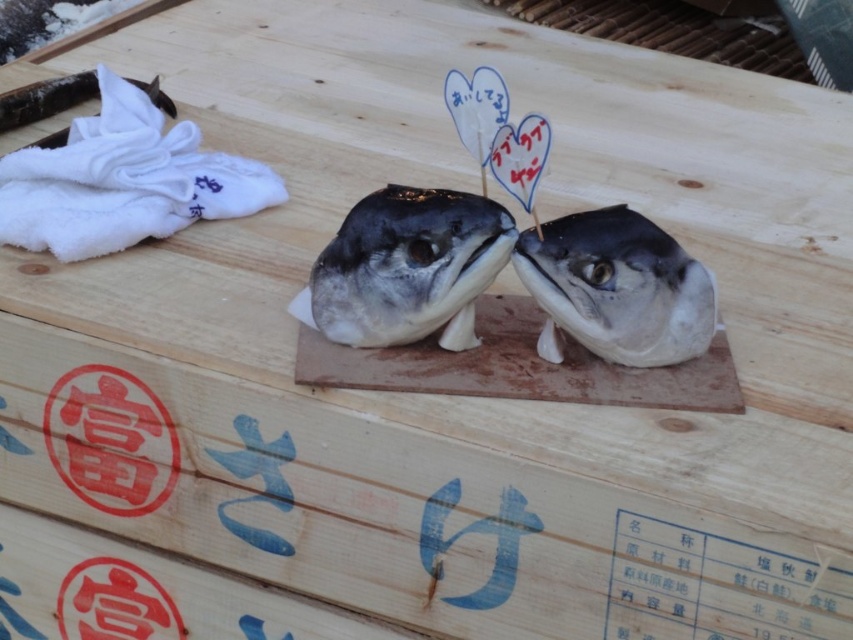
Question: Which object is the closest to the white towel at upper left?

Choices:
 (A) shiny black fish head at center
 (B) shiny silver fish head at center

Answer: (A)

Question: Is white towel at upper left wider than shiny black fish head at center?

Choices:
 (A) yes
 (B) no

Answer: (A)

Question: Is shiny black fish head at center positioned in front of shiny silver fish head at center?

Choices:
 (A) no
 (B) yes

Answer: (A)

Question: Which point appears farthest from the camera in this image?

Choices:
 (A) (80, 241)
 (B) (469, 288)
 (C) (577, 224)

Answer: (A)

Question: Estimate the real-world distances between objects in this image. Which object is closer to the white towel at upper left?

Choices:
 (A) shiny black fish head at center
 (B) shiny silver fish head at center

Answer: (A)

Question: Does white towel at upper left lie in front of shiny silver fish head at center?

Choices:
 (A) no
 (B) yes

Answer: (A)